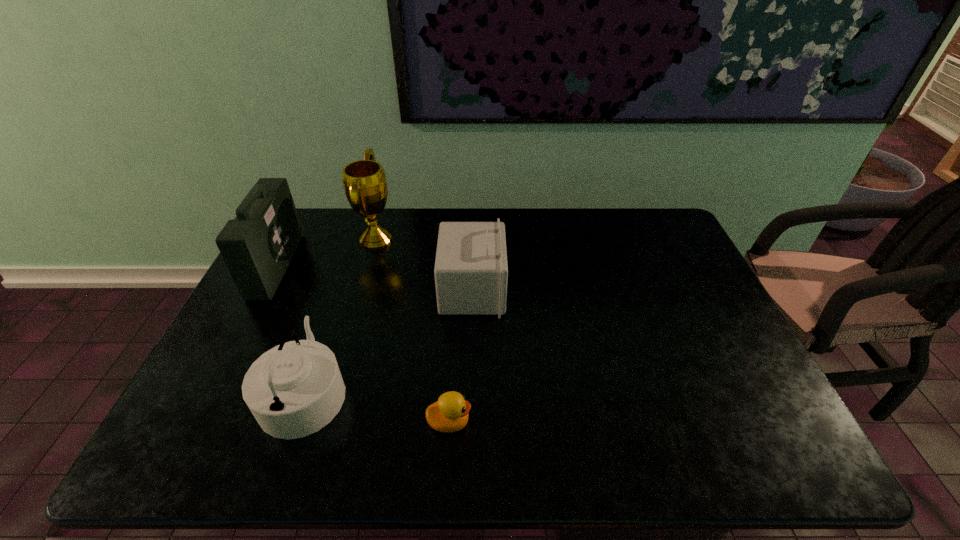
Find the location of a particular element. This screenshot has height=540, width=960. free space located 0.280m on the face of the duckling is located at coordinates (594, 422).

Locate an element on the screen. award that is at the far edge is located at coordinates (364, 181).

The height and width of the screenshot is (540, 960). In order to click on the first-aid kit situated at the far edge in this screenshot , I will do `click(257, 246)`.

Identify the location of kettle that is at the near edge. (293, 390).

I want to click on duckling located at the near edge, so click(449, 414).

At what (x,y) coordinates should I click in order to perform the action: click on the first-aid kit at the left edge. Please return your answer as a coordinate pair (x, y). This screenshot has height=540, width=960. Looking at the image, I should click on (257, 246).

The height and width of the screenshot is (540, 960). Find the location of `kettle present at the left edge`. kettle present at the left edge is located at coordinates (293, 390).

Locate an element on the screen. The image size is (960, 540). object that is positioned at the far left corner is located at coordinates (257, 246).

The width and height of the screenshot is (960, 540). Identify the location of object positioned at the near left corner. (293, 390).

At what (x,y) coordinates should I click in order to perform the action: click on free spot at the far edge of the desktop. Please return your answer as a coordinate pair (x, y). Looking at the image, I should click on (562, 232).